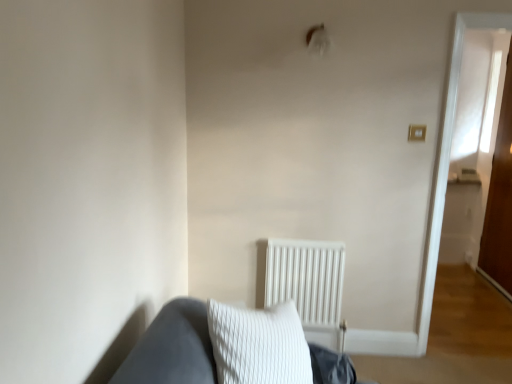
Locate an element on the screen. The height and width of the screenshot is (384, 512). vacant space positioned to the left of transparent glass door at right is located at coordinates (466, 290).